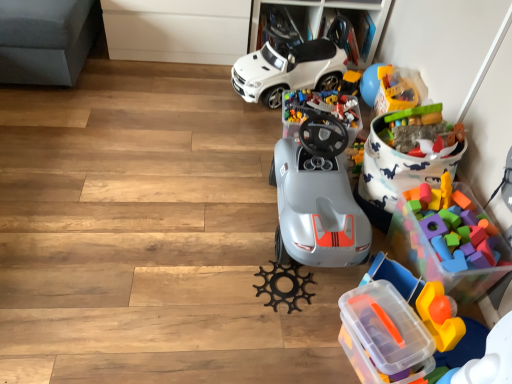
Find the location of `free space above black matte gear at center, the 2th toy in the bottom-to-top sequence (from a real-world perspective)`. free space above black matte gear at center, the 2th toy in the bottom-to-top sequence (from a real-world perspective) is located at coordinates (286, 285).